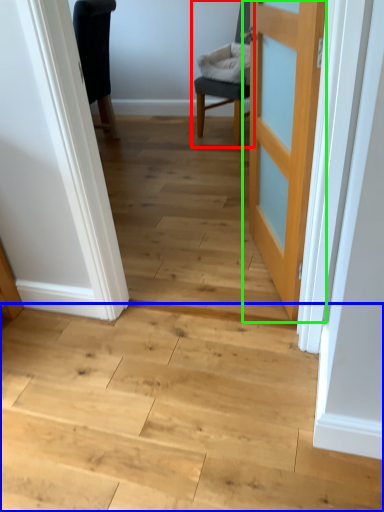
Question: Which object is the closest to the chair (highlighted by a red box)? Choose among these: stairwell (highlighted by a blue box) or door (highlighted by a green box).

Choices:
 (A) stairwell
 (B) door

Answer: (B)